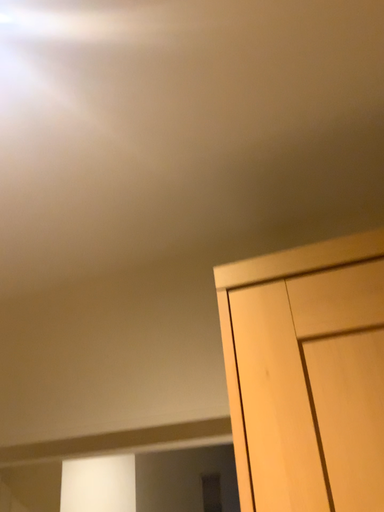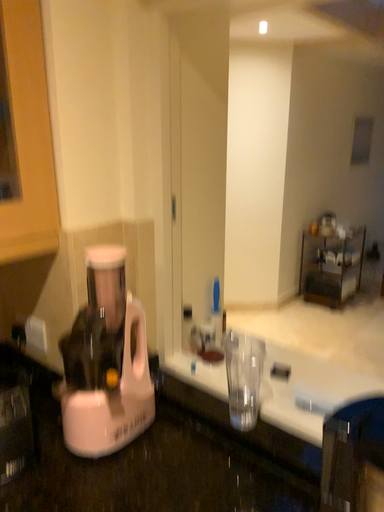
Question: How did the camera likely rotate when shooting the video?

Choices:
 (A) rotated right
 (B) rotated left

Answer: (B)